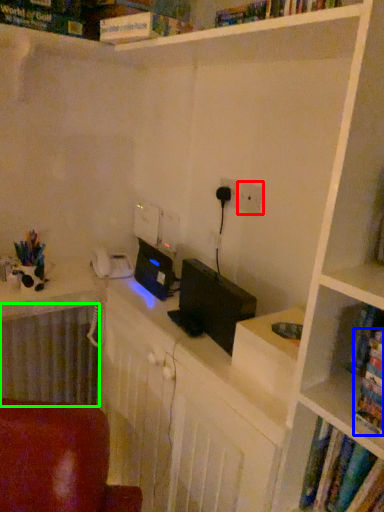
Question: Estimate the real-world distances between objects in this image. Which object is farther from electric outlet (highlighted by a red box), book (highlighted by a blue box) or radiator (highlighted by a green box)?

Choices:
 (A) book
 (B) radiator

Answer: (B)